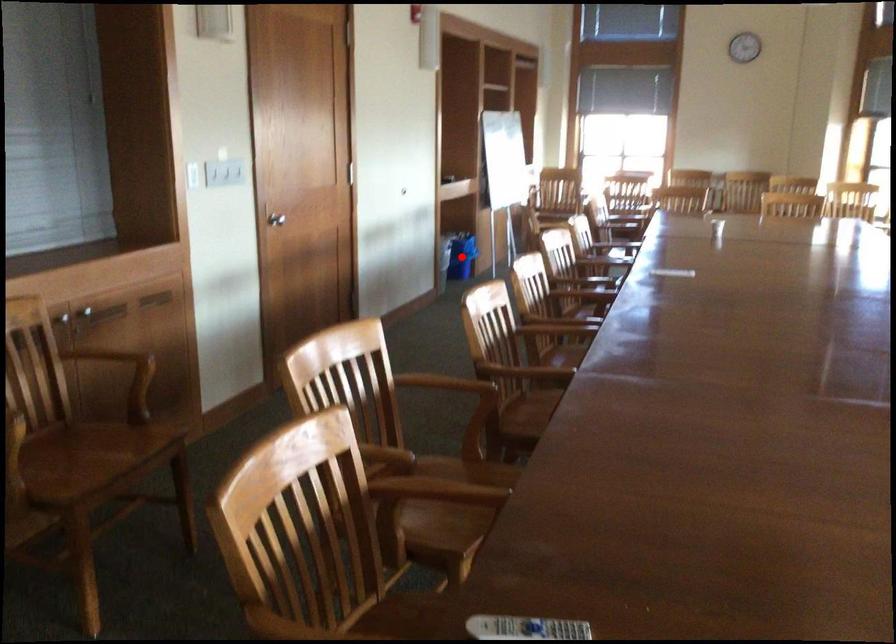
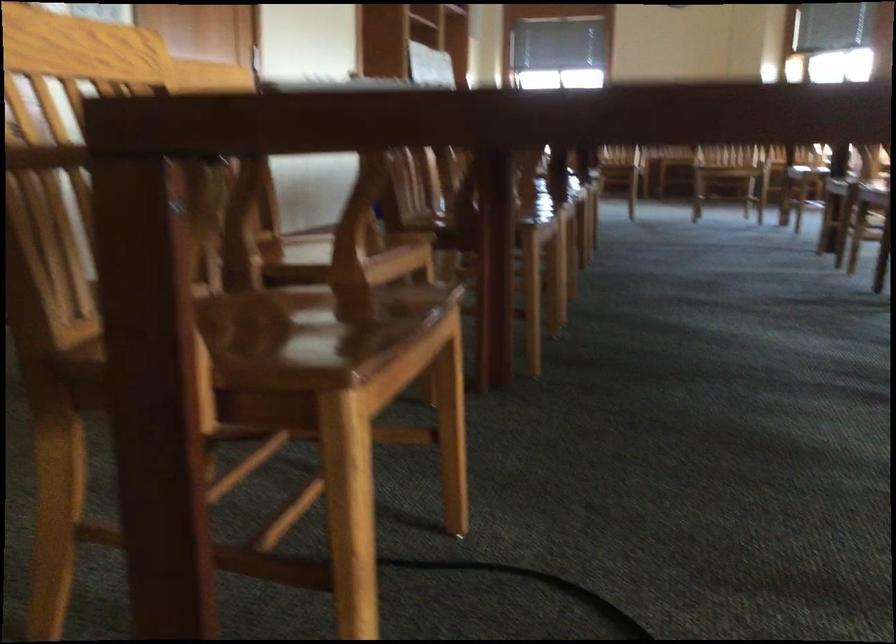
Question: I am providing you with two images of the same scene from different viewpoints. A red point is marked on the first image. At the location where the point appears in image 1, is it still visible in image 2?

Choices:
 (A) Yes
 (B) No

Answer: (B)